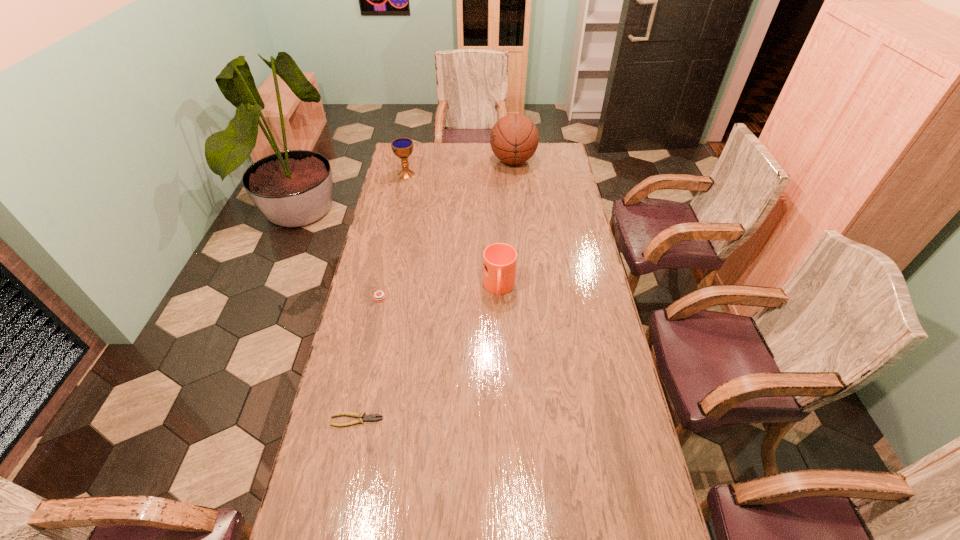
This screenshot has height=540, width=960. I want to click on basketball, so click(514, 138).

The image size is (960, 540). What are the coordinates of `chalice` in the screenshot? It's located at (402, 147).

You are a GUI agent. You are given a task and a screenshot of the screen. Output one action in this format:
    pyautogui.click(x=<x>, y=<y>)
    Task: Click on the mug
    This screenshot has width=960, height=540.
    Given the screenshot: What is the action you would take?
    pyautogui.click(x=499, y=260)

Where is `the second shortest object`? This screenshot has height=540, width=960. the second shortest object is located at coordinates (381, 296).

I want to click on the nearest object, so click(x=371, y=417).

Locate an element on the screen. This screenshot has width=960, height=540. pliers is located at coordinates (371, 417).

Locate an element on the screen. The width and height of the screenshot is (960, 540). vacant space located 0.390m on the side with brand label of the tallest object is located at coordinates click(415, 161).

You are a GUI agent. You are given a task and a screenshot of the screen. Output one action in this format:
    pyautogui.click(x=<x>, y=<y>)
    Task: Click on the free space located 0.110m on the side with brand label of the tallest object
    The height and width of the screenshot is (540, 960).
    Given the screenshot: What is the action you would take?
    pyautogui.click(x=468, y=161)

This screenshot has height=540, width=960. Find the location of `free point located on the side with brand label of the tallest object`. free point located on the side with brand label of the tallest object is located at coordinates (442, 161).

Find the location of a particular element. This screenshot has width=960, height=540. vacant space situated 0.220m on the front of the chalice is located at coordinates (399, 208).